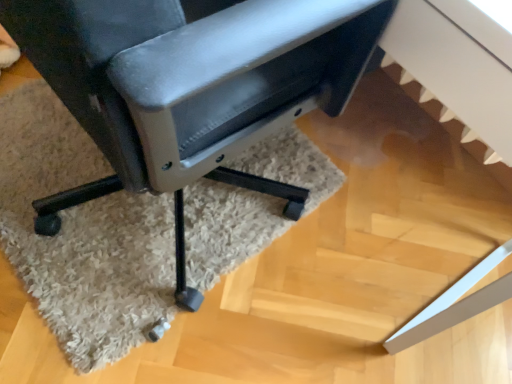
Question: Is matte black chair at center thinner than beige shaggy rug at lower center?

Choices:
 (A) no
 (B) yes

Answer: (B)

Question: Can you confirm if matte black chair at center is bigger than beige shaggy rug at lower center?

Choices:
 (A) yes
 (B) no

Answer: (A)

Question: Can you confirm if matte black chair at center is positioned to the right of beige shaggy rug at lower center?

Choices:
 (A) yes
 (B) no

Answer: (A)

Question: Does matte black chair at center have a greater height compared to beige shaggy rug at lower center?

Choices:
 (A) yes
 (B) no

Answer: (A)

Question: Is matte black chair at center located outside beige shaggy rug at lower center?

Choices:
 (A) no
 (B) yes

Answer: (B)

Question: Is matte black chair at center oriented away from beige shaggy rug at lower center?

Choices:
 (A) no
 (B) yes

Answer: (A)

Question: Is beige shaggy rug at lower center far from matte black chair at center?

Choices:
 (A) no
 (B) yes

Answer: (A)

Question: Is beige shaggy rug at lower center smaller than matte black chair at center?

Choices:
 (A) no
 (B) yes

Answer: (B)

Question: From the image's perspective, is beige shaggy rug at lower center above matte black chair at center?

Choices:
 (A) no
 (B) yes

Answer: (A)

Question: From the image's perspective, is beige shaggy rug at lower center below matte black chair at center?

Choices:
 (A) yes
 (B) no

Answer: (A)

Question: Is beige shaggy rug at lower center facing away from matte black chair at center?

Choices:
 (A) no
 (B) yes

Answer: (A)

Question: Can you confirm if beige shaggy rug at lower center is bigger than matte black chair at center?

Choices:
 (A) yes
 (B) no

Answer: (B)

Question: Considering the positions of beige shaggy rug at lower center and matte black chair at center in the image, is beige shaggy rug at lower center bigger or smaller than matte black chair at center?

Choices:
 (A) small
 (B) big

Answer: (A)